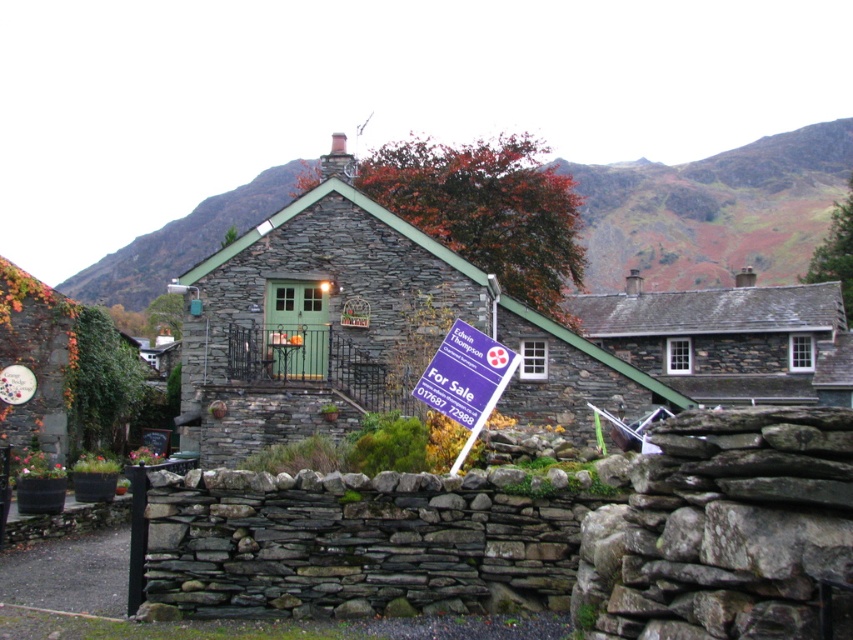
Question: Is stone slate cottage at center bigger than rustic stone cottage at center?

Choices:
 (A) no
 (B) yes

Answer: (B)

Question: Can you confirm if stone slate cottage at center is wider than white plastic sign at center?

Choices:
 (A) yes
 (B) no

Answer: (A)

Question: Is stone slate cottage at center closer to camera compared to white plastic sign at center?

Choices:
 (A) no
 (B) yes

Answer: (A)

Question: Based on their relative distances, which object is farther from the white plastic sign at center?

Choices:
 (A) rustic stone cottage at center
 (B) stone slate cottage at center

Answer: (A)

Question: Which point is farther to the camera?

Choices:
 (A) stone slate cottage at center
 (B) rustic stone cottage at center
 (C) white plastic sign at center

Answer: (B)

Question: Which object is farther from the camera taking this photo?

Choices:
 (A) stone slate cottage at center
 (B) white plastic sign at center
 (C) rustic stone cottage at center

Answer: (C)